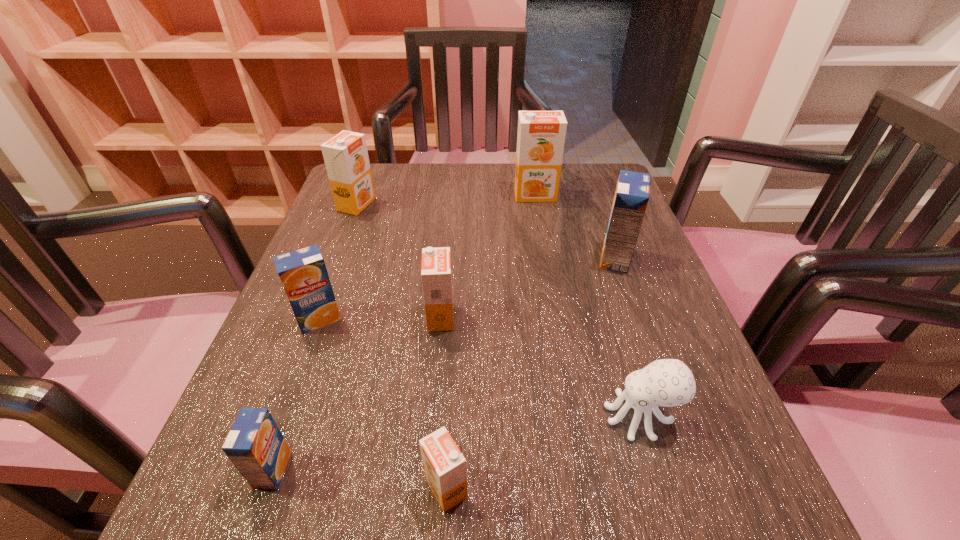
The image size is (960, 540). What are the coordinates of `the smallest blue orange_juice` in the screenshot? It's located at (255, 445).

You are a GUI agent. You are given a task and a screenshot of the screen. Output one action in this format:
    pyautogui.click(x=<x>, y=<y>)
    Task: Click on the blank area located on the left of the rightmost orange orange juice
    
    Given the screenshot: What is the action you would take?
    pyautogui.click(x=456, y=195)

This screenshot has height=540, width=960. What are the coordinates of `free space located 0.310m on the right of the leftmost orange orange juice` in the screenshot? It's located at (499, 205).

Locate an element on the screen. This screenshot has height=540, width=960. vacant space situated on the back of the third farthest orange_juice is located at coordinates (589, 185).

The image size is (960, 540). I want to click on vacant space located 0.330m on the back of the second smallest orange orange juice, so click(450, 207).

Where is `vacant position located 0.330m on the right of the second biggest blue orange_juice`? Image resolution: width=960 pixels, height=540 pixels. vacant position located 0.330m on the right of the second biggest blue orange_juice is located at coordinates (522, 319).

The height and width of the screenshot is (540, 960). In order to click on free space located 0.300m on the front-facing side of the white octopus in this screenshot , I will do `click(404, 416)`.

Where is `vacant space located on the front-facing side of the white octopus`? This screenshot has width=960, height=540. vacant space located on the front-facing side of the white octopus is located at coordinates (438, 416).

Locate an element on the screen. This screenshot has width=960, height=540. vacant space located 0.310m on the front-facing side of the white octopus is located at coordinates (397, 416).

I want to click on vacant space situated 0.310m on the right of the smallest orange orange juice, so click(703, 488).